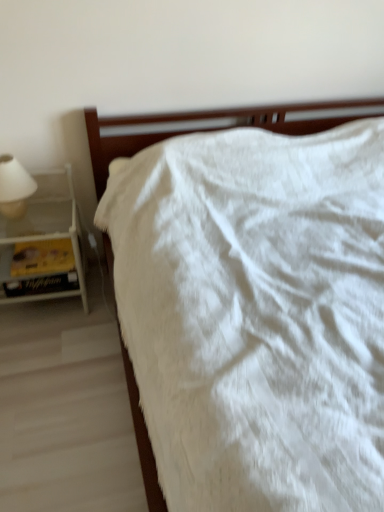
Question: From a real-world perspective, is white glossy nightstand at left located higher than yellow paper at left?

Choices:
 (A) no
 (B) yes

Answer: (B)

Question: Is white glossy nightstand at left not near yellow paper at left?

Choices:
 (A) yes
 (B) no

Answer: (B)

Question: Is yellow paper at left at the back of white glossy nightstand at left?

Choices:
 (A) no
 (B) yes

Answer: (B)

Question: Does white glossy nightstand at left have a lesser width compared to yellow paper at left?

Choices:
 (A) yes
 (B) no

Answer: (B)

Question: Does white glossy nightstand at left have a greater width compared to yellow paper at left?

Choices:
 (A) no
 (B) yes

Answer: (B)

Question: From the image's perspective, does white glossy nightstand at left appear higher than yellow paper at left?

Choices:
 (A) no
 (B) yes

Answer: (B)

Question: Would you say white glossy nightstand at left is part of white fluffy blanket at center's contents?

Choices:
 (A) yes
 (B) no

Answer: (B)

Question: Would you say white fluffy blanket at center is outside white glossy nightstand at left?

Choices:
 (A) yes
 (B) no

Answer: (A)

Question: Considering the relative positions of white fluffy blanket at center and white glossy nightstand at left in the image provided, is white fluffy blanket at center to the right of white glossy nightstand at left from the viewer's perspective?

Choices:
 (A) no
 (B) yes

Answer: (B)

Question: Is white fluffy blanket at center further to the viewer compared to white glossy nightstand at left?

Choices:
 (A) no
 (B) yes

Answer: (A)

Question: From a real-world perspective, is white fluffy blanket at center on top of white glossy nightstand at left?

Choices:
 (A) yes
 (B) no

Answer: (A)

Question: Can you confirm if white fluffy blanket at center is thinner than white glossy nightstand at left?

Choices:
 (A) no
 (B) yes

Answer: (A)

Question: Is yellow paper at left wider than white fluffy blanket at center?

Choices:
 (A) no
 (B) yes

Answer: (A)